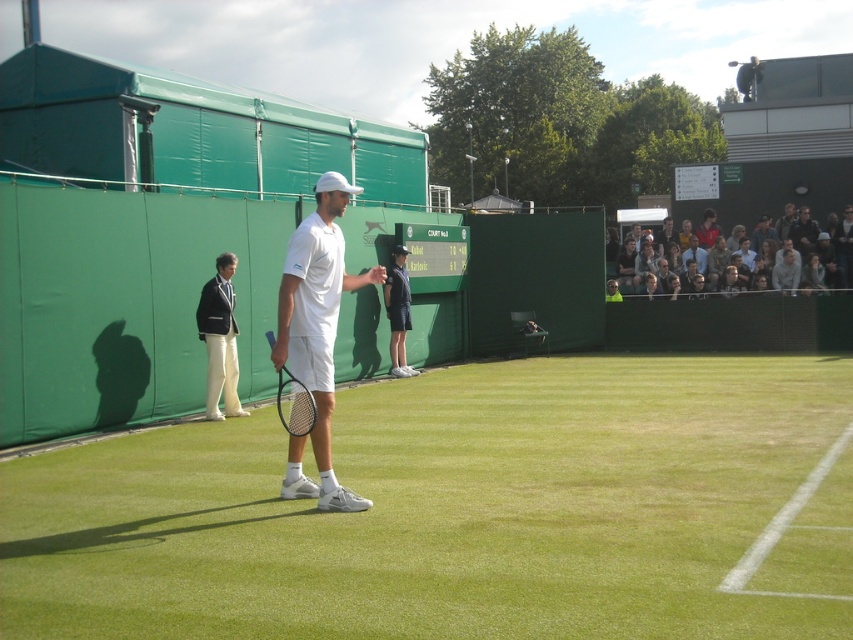
You are a photographer standing at the camera position. You want to take a photo of the white wool blazer at left. Is it within your camera lens range which has a maximum focus distance of 12 meters?

The white wool blazer at left is 11.98 meters from camera, so yes, it is within the camera lens range since it is just under 12 meters.

Consider the image. You are a photographer at the tennis match and want to capture a photo of the black matte tennis racket at center without the white wool blazer at left appearing in the frame. Is this possible given their positions?

The white wool blazer at left is positioned on the left side of the black matte tennis racket at center, so if you position yourself to the right of the racket, the blazer would be out of the frame. Therefore, it is possible to capture the black matte tennis racket at center without the white wool blazer at left appearing in the frame.

You are a photographer standing at the center of the tennis court. You want to capture a photo of the light brown leather jacket at upper right. Which direction should you face to ensure it is in the frame?

The light brown leather jacket at upper right is located at point [761,232], so you should face the upper right direction to capture it in the frame.